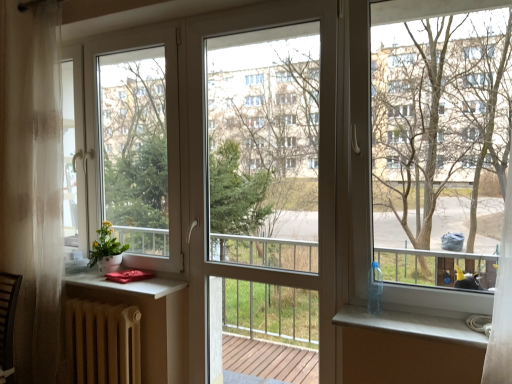
At what (x,y) coordinates should I click in order to perform the action: click on matte brown radiator at lower left. Please return your answer as a coordinate pair (x, y). The width and height of the screenshot is (512, 384). Looking at the image, I should click on (148, 320).

Where is `bare wood tree at right`? This screenshot has height=384, width=512. bare wood tree at right is located at coordinates (438, 140).

What is the approximate width of transparent glass screen door at center?

transparent glass screen door at center is 1.51 inches wide.

I want to click on matte white pot at left, so click(106, 250).

In the image, is bare wood tree at right positioned in front of or behind matte brown radiator at lower left?

bare wood tree at right is positioned closer to the viewer than matte brown radiator at lower left.

Is point (386, 137) closer or farther from the camera than point (167, 356)?

Point (386, 137).

Can you confirm if bare wood tree at right is shorter than matte brown radiator at lower left?

No.

Is transparent glass screen door at center surrounded by bare wood tree at right?

Actually, transparent glass screen door at center is outside bare wood tree at right.

Considering the relative positions of bare wood tree at right and transparent glass screen door at center in the image provided, is bare wood tree at right to the right of transparent glass screen door at center from the viewer's perspective?

Indeed, bare wood tree at right is positioned on the right side of transparent glass screen door at center.

From the picture: Is bare wood tree at right turned away from transparent glass screen door at center?

No.

Considering the sizes of objects bare wood tree at right and transparent glass screen door at center in the image provided, who is smaller, bare wood tree at right or transparent glass screen door at center?

transparent glass screen door at center.

Is bare wood tree at right to the left of white glossy window sill at lower right from the viewer's perspective?

In fact, bare wood tree at right is to the right of white glossy window sill at lower right.

Consider the image. From a real-world perspective, is bare wood tree at right located higher than white glossy window sill at lower right?

Yes, from a real-world perspective, bare wood tree at right is over white glossy window sill at lower right

Is bare wood tree at right positioned with its back to white glossy window sill at lower right?

No, bare wood tree at right is not facing the opposite direction of white glossy window sill at lower right.

From the picture: Are transparent glass screen door at center and white glossy window sill at lower right far apart?

No.

At what (x,y) coordinates should I click in order to perform the action: click on window sill that is in front of the transparent glass screen door at center. Please return your answer as a coordinate pair (x, y). The height and width of the screenshot is (384, 512). Looking at the image, I should click on (412, 325).

Who is taller, transparent glass screen door at center or white glossy window sill at lower right?

With more height is transparent glass screen door at center.

From the image's perspective, is transparent glass screen door at center on white glossy window sill at lower right?

Indeed, from the image's perspective, transparent glass screen door at center is shown above white glossy window sill at lower right.

Considering the sizes of objects matte brown radiator at lower left and white glossy window sill at lower right in the image provided, who is thinner, matte brown radiator at lower left or white glossy window sill at lower right?

matte brown radiator at lower left is thinner.

Could you tell me if matte brown radiator at lower left is facing white glossy window sill at lower right?

No, matte brown radiator at lower left does not turn towards white glossy window sill at lower right.

In terms of size, does matte brown radiator at lower left appear bigger or smaller than white glossy window sill at lower right?

In the image, matte brown radiator at lower left appears to be larger than white glossy window sill at lower right.

There is a matte brown radiator at lower left. Identify the location of window sill above it (from a real-world perspective). (412, 325).

Which of these two, matte white pot at left or bare wood tree at right, stands shorter?

Standing shorter between the two is matte white pot at left.

Is matte white pot at left not within bare wood tree at right?

Yes, matte white pot at left is located beyond the bounds of bare wood tree at right.

The height and width of the screenshot is (384, 512). Identify the location of tree that is in front of the matte white pot at left. (438, 140).

Based on the photo, which object is thinner, matte white pot at left or bare wood tree at right?

With smaller width is bare wood tree at right.

Are white glossy window sill at lower right and bare wood tree at right beside each other?

white glossy window sill at lower right is not next to bare wood tree at right, and they're not touching.

From the picture: From a real-world perspective, which object rests below the other?

white glossy window sill at lower right.

Is white glossy window sill at lower right thinner than bare wood tree at right?

No.

Is white glossy window sill at lower right outside of bare wood tree at right?

Actually, white glossy window sill at lower right is at least partially inside bare wood tree at right.

Identify the location of table behind the bare wood tree at right. The image size is (512, 384). (148, 320).

Locate an element on the screen. screen door that is on the left side of bare wood tree at right is located at coordinates (264, 171).

From the image, which object appears to be nearer to matte brown radiator at lower left, white glossy window sill at lower right or matte white pot at left?

The object closer to matte brown radiator at lower left is matte white pot at left.

Which object lies nearer to the anchor point matte white pot at left, transparent glass screen door at center or matte brown radiator at lower left?

Among the two, matte brown radiator at lower left is located nearer to matte white pot at left.

Which object lies nearer to the anchor point white glossy window sill at lower right, bare wood tree at right or transparent glass screen door at center?

transparent glass screen door at center is positioned closer to the anchor white glossy window sill at lower right.

Looking at the image, which one is located closer to transparent glass screen door at center, white glossy window sill at lower right or matte brown radiator at lower left?

The object closer to transparent glass screen door at center is matte brown radiator at lower left.

Considering their positions, is transparent glass screen door at center positioned closer to matte white pot at left than bare wood tree at right?

Based on the image, transparent glass screen door at center appears to be nearer to matte white pot at left.

When comparing their distances from matte brown radiator at lower left, does transparent glass screen door at center or bare wood tree at right seem further?

bare wood tree at right.

Considering their positions, is bare wood tree at right positioned further to matte brown radiator at lower left than transparent glass screen door at center?

bare wood tree at right.

Based on their spatial positions, is white glossy window sill at lower right or transparent glass screen door at center further from bare wood tree at right?

white glossy window sill at lower right is further to bare wood tree at right.

I want to click on window sill between matte brown radiator at lower left and bare wood tree at right from left to right, so click(412, 325).

You are a GUI agent. You are given a task and a screenshot of the screen. Output one action in this format:
    pyautogui.click(x=<x>, y=<y>)
    Task: Click on the screen door between matte white pot at left and white glossy window sill at lower right from left to right
    This screenshot has width=512, height=384.
    Given the screenshot: What is the action you would take?
    pyautogui.click(x=264, y=171)

The image size is (512, 384). What are the coordinates of `houseplant between matte brown radiator at lower left and white glossy window sill at lower right in the horizontal direction` in the screenshot? It's located at (106, 250).

At what (x,y) coordinates should I click in order to perform the action: click on houseplant between matte brown radiator at lower left and bare wood tree at right in the horizontal direction. Please return your answer as a coordinate pair (x, y). Looking at the image, I should click on (106, 250).